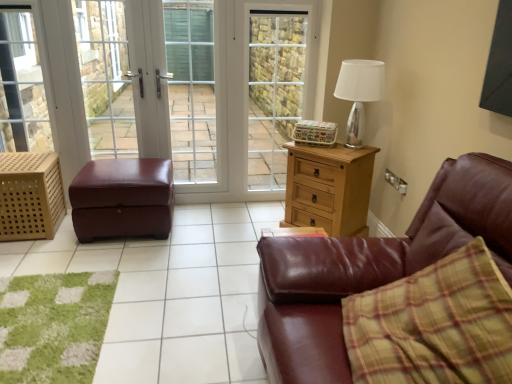
Question: From a real-world perspective, is clear glass screen door at center, the 2th screen door viewed from the left, physically located above or below light brown wooden chest of drawers at center right?

Choices:
 (A) above
 (B) below

Answer: (A)

Question: Looking at their shapes, would you say clear glass screen door at center, which is the 1th screen door in right-to-left order, is wider or thinner than light brown wooden chest of drawers at center right?

Choices:
 (A) thin
 (B) wide

Answer: (A)

Question: Estimate the real-world distances between objects in this image. Which object is farther from the wooden lattice basket at left?

Choices:
 (A) clear glass window at left
 (B) brown leather ottoman at center
 (C) brown leather ottoman at left
 (D) silver metallic table lamp at upper right
 (E) matte white screen door at center, the 2th screen door positioned from the right

Answer: (D)

Question: Estimate the real-world distances between objects in this image. Which object is closer to the wooden lattice basket at left?

Choices:
 (A) brown leather couch at right
 (B) burgundy leather ottoman at left
 (C) light brown wooden chest of drawers at center right
 (D) brown leather ottoman at left
 (E) clear glass screen door at center, which is the 1th screen door in right-to-left order

Answer: (B)